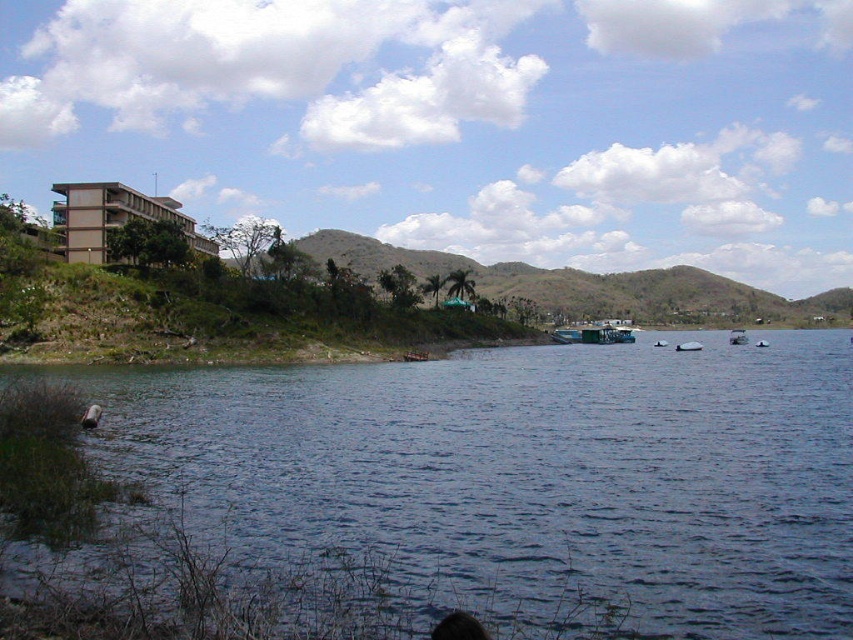
Who is taller, blue water at center or green matte boat at center?

green matte boat at center

Measure the distance from blue water at center to green matte boat at center.

The distance of blue water at center from green matte boat at center is 91.28 meters.

Does point (432, 563) come closer to viewer compared to point (625, 330)?

Yes, point (432, 563) is closer to viewer.

Locate an element on the screen. blue water at center is located at coordinates (525, 477).

Can you confirm if blue water at center is positioned below green leafy hillside at center?

Yes.

Is blue water at center to the left of green leafy hillside at center from the viewer's perspective?

Indeed, blue water at center is positioned on the left side of green leafy hillside at center.

Image resolution: width=853 pixels, height=640 pixels. Find the location of `blue water at center`. blue water at center is located at coordinates (525, 477).

How much distance is there between green matte boat at center and white plastic boat at center?

green matte boat at center and white plastic boat at center are 77.50 meters apart from each other.

Does green matte boat at center have a greater height compared to white plastic boat at center?

Indeed, green matte boat at center has a greater height compared to white plastic boat at center.

Where is `green matte boat at center`? green matte boat at center is located at coordinates (593, 333).